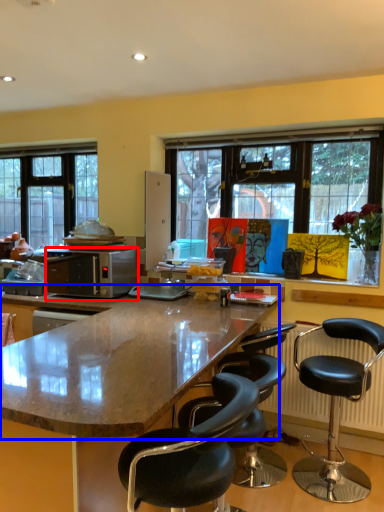
Question: Which of the following is the closest to the observer, microwave oven (highlighted by a red box) or countertop (highlighted by a blue box)?

Choices:
 (A) microwave oven
 (B) countertop

Answer: (B)